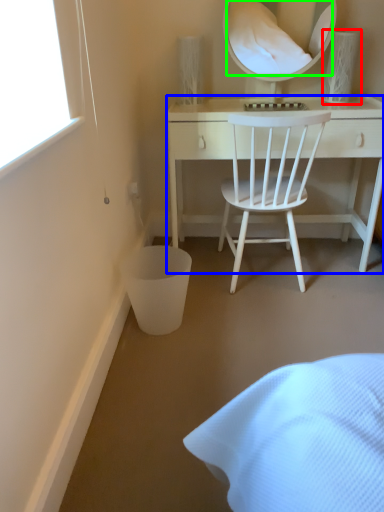
Question: Based on their relative distances, which object is farther from table lamp (highlighted by a red box)? Choose from desk (highlighted by a blue box) and mirror (highlighted by a green box).

Choices:
 (A) desk
 (B) mirror

Answer: (B)